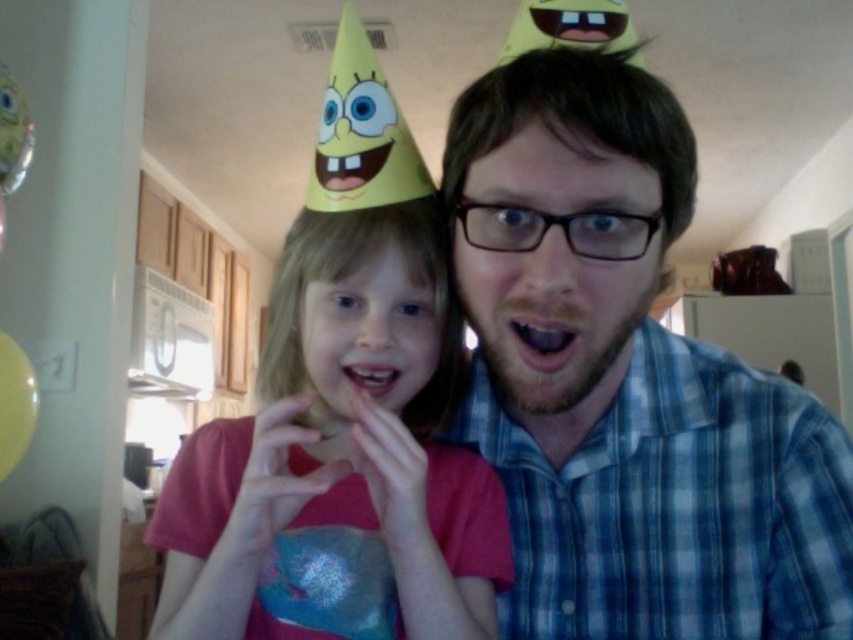
Consider the image. You are a photographer setting up for a family photo. You need to ensure that both the blue plaid shirt at center and the pink fabric dress at center are visible in the frame. Based on their positions, which one should you focus on first to capture both in the shot?

The blue plaid shirt at center is above the pink fabric dress at center, so focusing on the blue plaid shirt at center first will ensure both are in the frame since it is higher up.

You are a photographer adjusting your camera to focus on the blue plaid shirt at center and the pink fabric dress at center. Which one should you focus on first to ensure both are in sharp focus?

The blue plaid shirt at center is closer to the viewer than the pink fabric dress at center, so focus on the blue plaid shirt at center first to ensure both are in sharp focus.

You are a photographer setting up for a family photo. You need to position the blue plaid shirt at center and the pink fabric dress at center so that they are exactly 5 inches apart. Based on the current scene, will you need to move them closer together or farther apart?

The blue plaid shirt at center is currently 5.23 inches from the pink fabric dress at center. Since 5.23 inches is more than 5 inches, you need to move them closer together to achieve the desired distance.